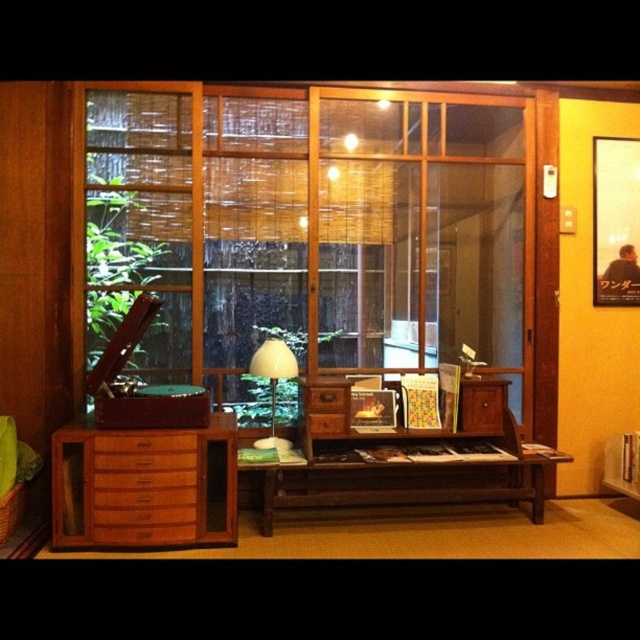
Identify the location of wooden cabinet at left. pyautogui.click(x=145, y=486).

Who is more distant from viewer, (180, 496) or (321, 404)?

Point (321, 404)

In order to click on wooden cabinet at left in this screenshot , I will do `click(145, 486)`.

Between point (212, 504) and point (340, 420), which one is positioned in front?

Point (212, 504)

Where is `wooden cabinet at left`? Image resolution: width=640 pixels, height=640 pixels. wooden cabinet at left is located at coordinates (145, 486).

Image resolution: width=640 pixels, height=640 pixels. What do you see at coordinates (144, 490) in the screenshot?
I see `wooden drawer at left` at bounding box center [144, 490].

Which is behind, point (106, 449) or point (324, 404)?

The point (324, 404) is more distant.

In order to click on wooden drawer at left in this screenshot , I will do [x=144, y=490].